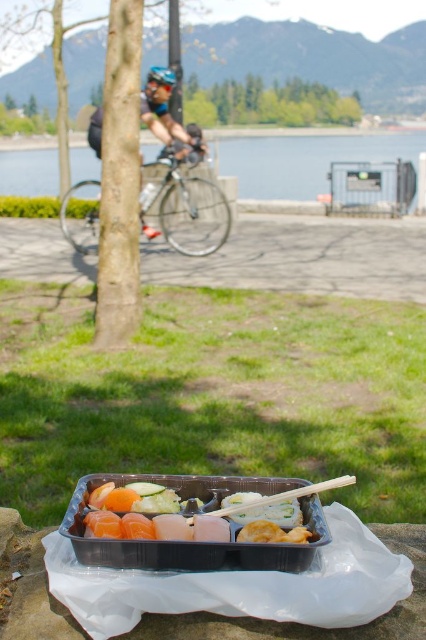
You are a hiker who wants to take a photo of the blue water at center and the blue matte helmet at upper center. Which object should you adjust your camera to focus on first if you want to capture both in the same frame?

The blue water at center is positioned on the right side of blue matte helmet at upper center, so you should focus on the blue matte helmet at upper center first as it is closer to the camera and adjust the focus to include the blue water at center on the right.

You are a delivery person who needs to pick up the shiny plastic sushi tray at center and the blue matte helmet at upper center. Which object should you grab first if you want to reach the one closer to your current position?

The blue matte helmet at upper center is closer to you than the shiny plastic sushi tray at center, so you should grab the blue matte helmet at upper center first.